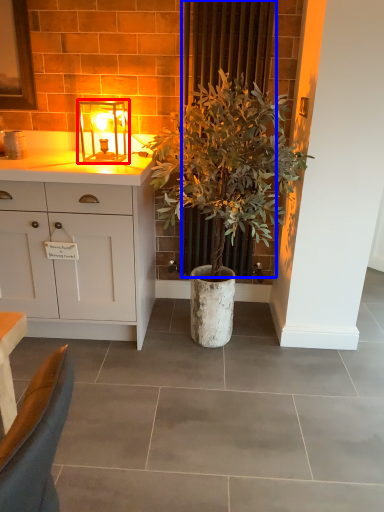
Question: Among these objects, which one is farthest to the camera, lamp (highlighted by a red box) or curtain (highlighted by a blue box)?

Choices:
 (A) lamp
 (B) curtain

Answer: (A)